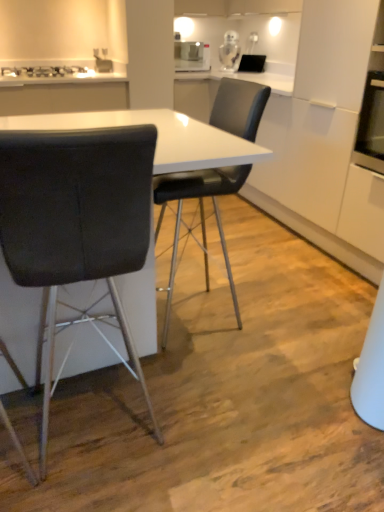
This screenshot has width=384, height=512. In order to click on vacant region to the right of black leather chair at center, which is the 1th chair from right to left in this screenshot , I will do `click(288, 314)`.